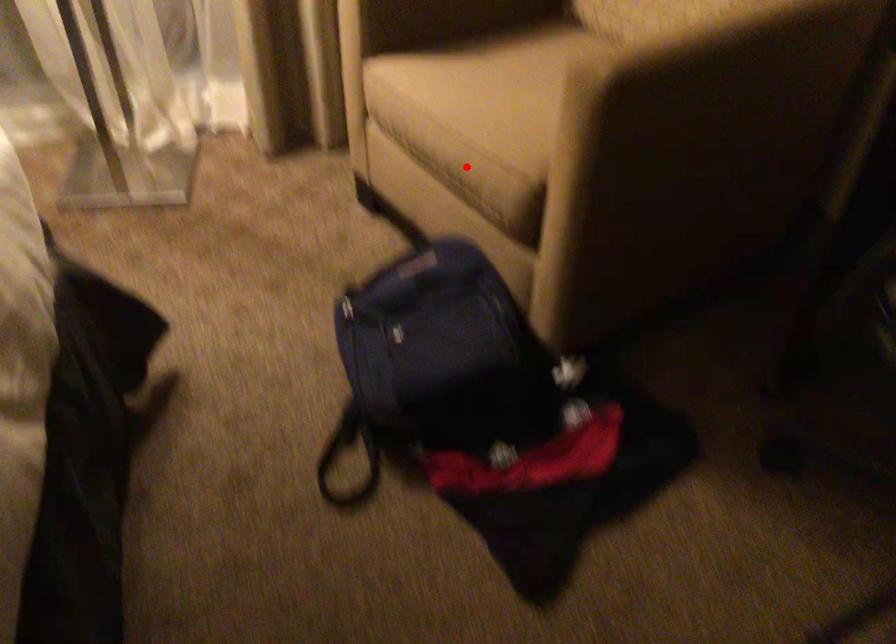
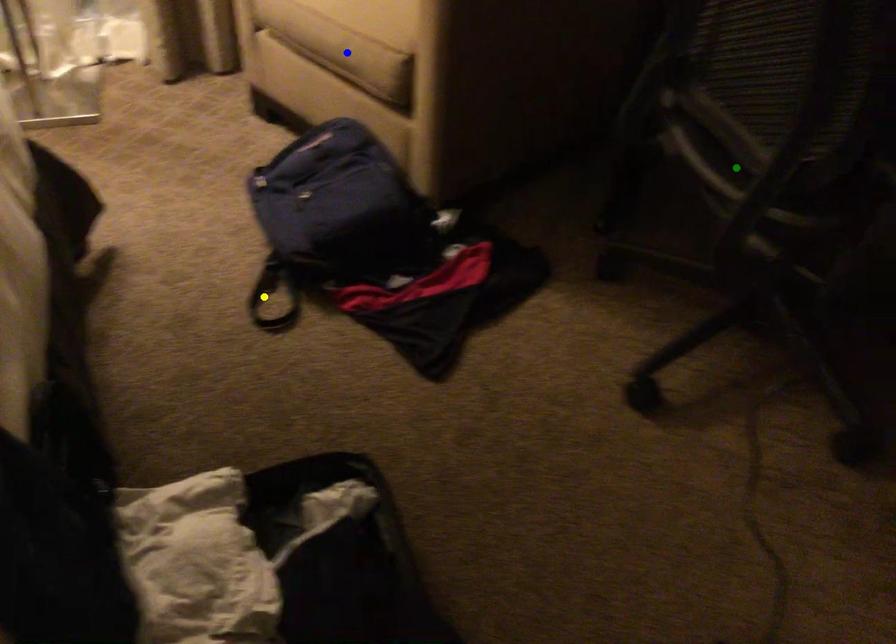
Question: I am providing you with two images of the same scene from different viewpoints. A red point is marked on the first image. You are given multiple points on the second image. Which point in image 2 represents the same 3d spot as the red point in image 1?

Choices:
 (A) green point
 (B) blue point
 (C) yellow point

Answer: (B)